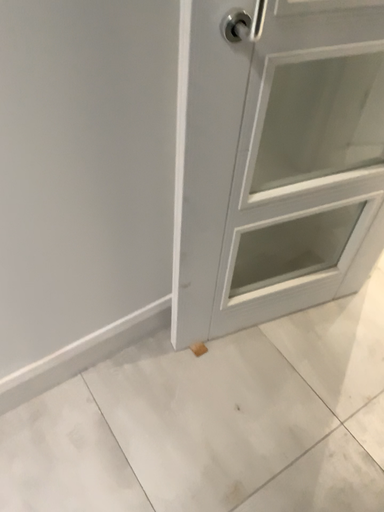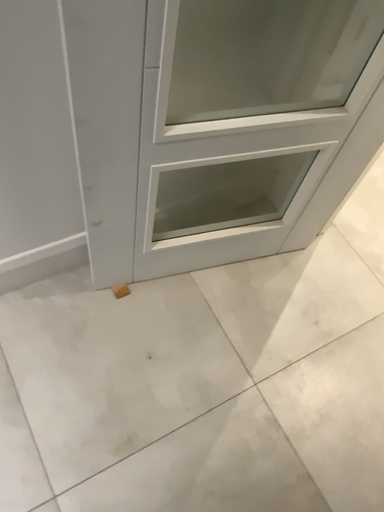
Question: How did the camera likely rotate when shooting the video?

Choices:
 (A) rotated downward
 (B) rotated upward

Answer: (A)